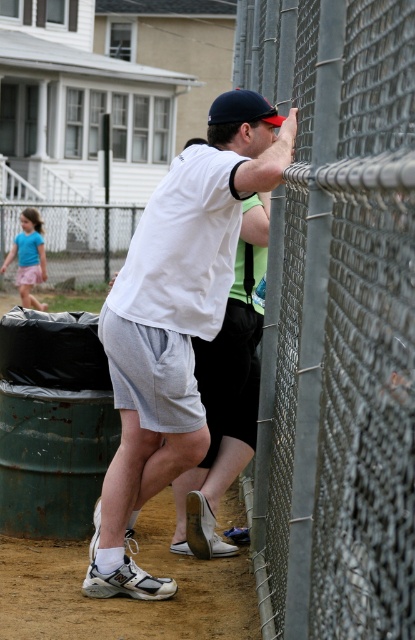
Is point (310, 531) farther from camera compared to point (104, 344)?

No, (310, 531) is closer to viewer.

Which of these two, metallic chain-link fence at right or white matte shorts at center, stands shorter?

Standing shorter between the two is metallic chain-link fence at right.

Is point (380, 140) farther from camera compared to point (202, 198)?

No, it is in front of (202, 198).

In order to click on metallic chain-link fence at right in this screenshot , I will do `click(336, 321)`.

Is point (31, 244) positioned before point (222, 106)?

No, (31, 244) is further to viewer.

Which is below, matte blue shirt at lower left or dark blue fabric baseball cap at upper center?

dark blue fabric baseball cap at upper center is below.

Does point (21, 250) come behind point (221, 93)?

That is True.

This screenshot has width=415, height=640. I want to click on matte blue shirt at lower left, so click(x=29, y=257).

Image resolution: width=415 pixels, height=640 pixels. What do you see at coordinates (173, 330) in the screenshot?
I see `white matte shorts at center` at bounding box center [173, 330].

Which is more to the right, white matte shorts at center or dark blue fabric baseball cap at upper center?

dark blue fabric baseball cap at upper center is more to the right.

Is point (134, 484) positioned after point (241, 112)?

Yes, point (134, 484) is behind point (241, 112).

Find the location of a particular element. The height and width of the screenshot is (640, 415). white matte shorts at center is located at coordinates (173, 330).